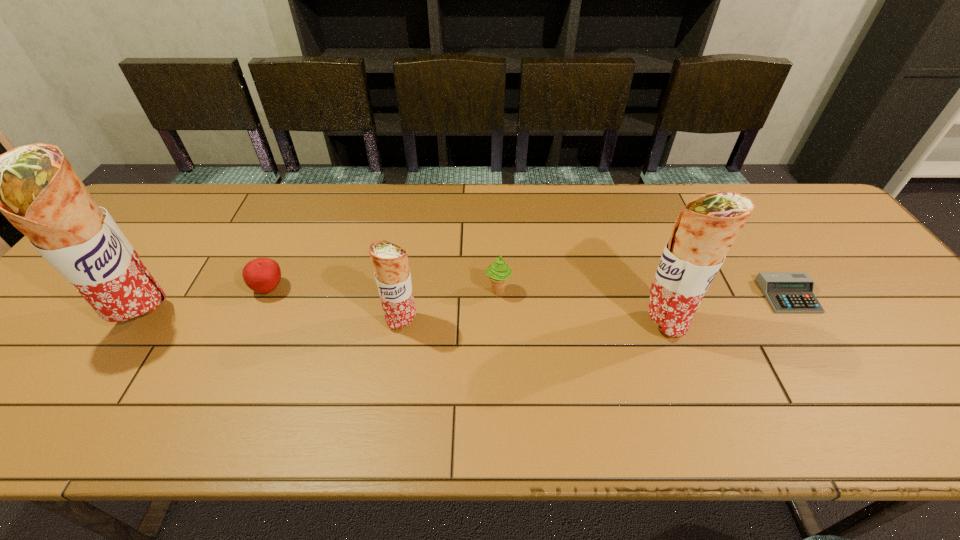
Locate an element on the screen. The height and width of the screenshot is (540, 960). vacant area between the calculator and the fourth shortest object is located at coordinates (595, 308).

At what (x,y) coordinates should I click in order to perform the action: click on free space between the second burrito from left to right and the shortest object. Please return your answer as a coordinate pair (x, y). Image resolution: width=960 pixels, height=540 pixels. Looking at the image, I should click on (595, 308).

Identify the location of blank region between the fourth shortest object and the leftmost object. The width and height of the screenshot is (960, 540). (274, 320).

This screenshot has width=960, height=540. I want to click on vacant space that is in between the fourth object from left to right and the leftmost burrito, so click(322, 305).

Locate an element on the screen. The width and height of the screenshot is (960, 540). free point between the shortest object and the second burrito from right to left is located at coordinates (595, 308).

Image resolution: width=960 pixels, height=540 pixels. I want to click on free area in between the fifth object from right to left and the shortest burrito, so click(x=336, y=305).

The width and height of the screenshot is (960, 540). In order to click on free spot between the shortest object and the second burrito from left to right in this screenshot , I will do click(595, 308).

Point out which object is positioned as the fifth nearest to the second tallest burrito. Please provide its 2D coordinates. Your answer should be formatted as a tuple, i.e. [(x, y)], where the tuple contains the x and y coordinates of a point satisfying the conditions above.

[(34, 186)]

Where is `object that is the second nearest to the third object from left to right`? This screenshot has width=960, height=540. object that is the second nearest to the third object from left to right is located at coordinates (263, 275).

Point out which burrito is positioned as the second nearest to the calculator. Please provide its 2D coordinates. Your answer should be formatted as a tuple, i.e. [(x, y)], where the tuple contains the x and y coordinates of a point satisfying the conditions above.

[(390, 261)]